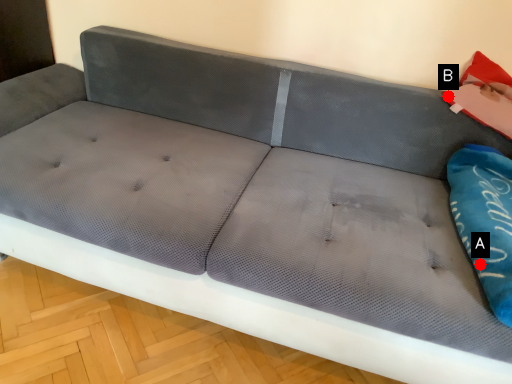
Question: Two points are circled on the image, labeled by A and B beside each circle. Which point is further to the camera?

Choices:
 (A) A is further
 (B) B is further

Answer: (B)